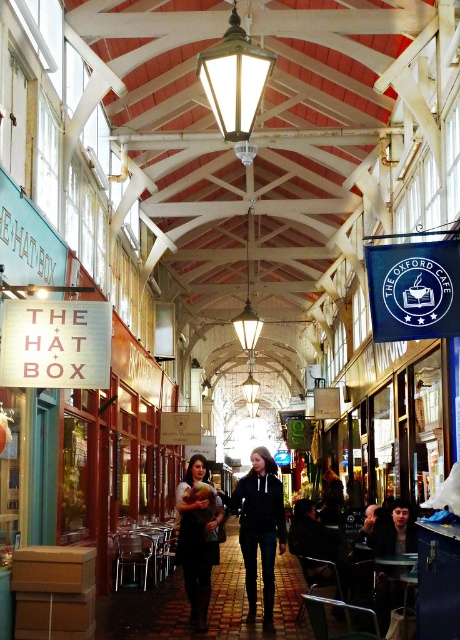
Question: Is black hoodie at center wider than matte black dress at center?

Choices:
 (A) no
 (B) yes

Answer: (B)

Question: Does black hoodie at center lie in front of matte black dress at center?

Choices:
 (A) yes
 (B) no

Answer: (A)

Question: Which object appears closest to the camera in this image?

Choices:
 (A) matte black dress at center
 (B) black hoodie at center

Answer: (B)

Question: Is black hoodie at center in front of matte black dress at center?

Choices:
 (A) no
 (B) yes

Answer: (B)

Question: Among these points, which one is nearest to the camera?

Choices:
 (A) (240, 509)
 (B) (203, 605)

Answer: (B)